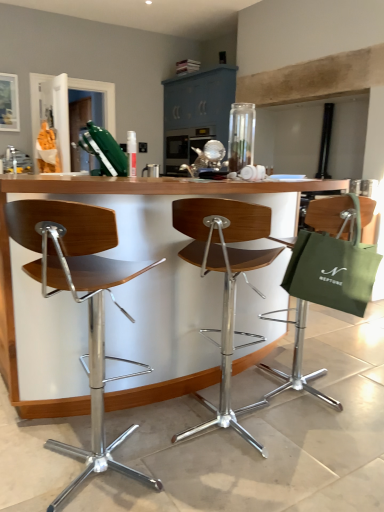
Find the location of `free space to the back side of green fabric bag at right, the 3th chair positioned from the left`. free space to the back side of green fabric bag at right, the 3th chair positioned from the left is located at coordinates (302, 358).